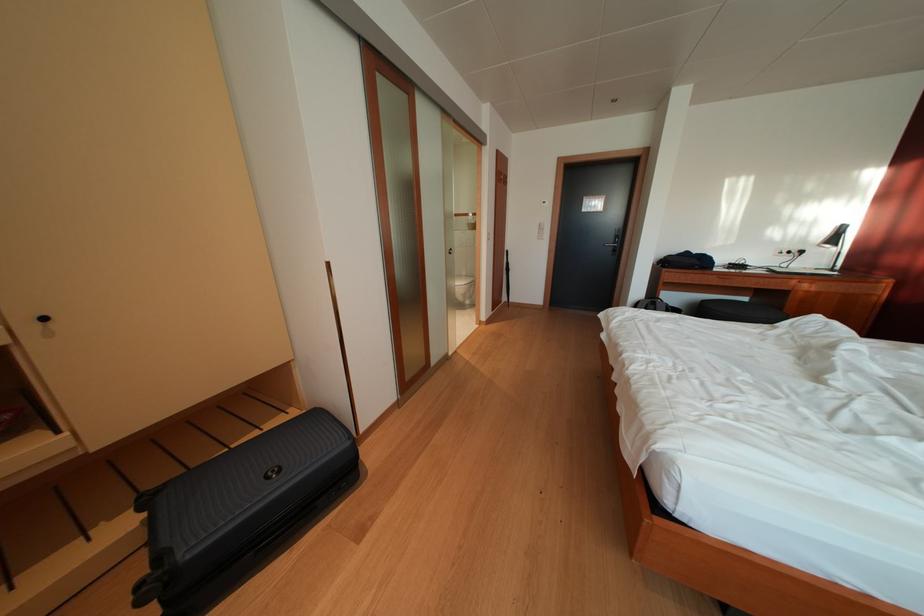
Where is `chair sitting surface`? This screenshot has height=616, width=924. chair sitting surface is located at coordinates (738, 310).